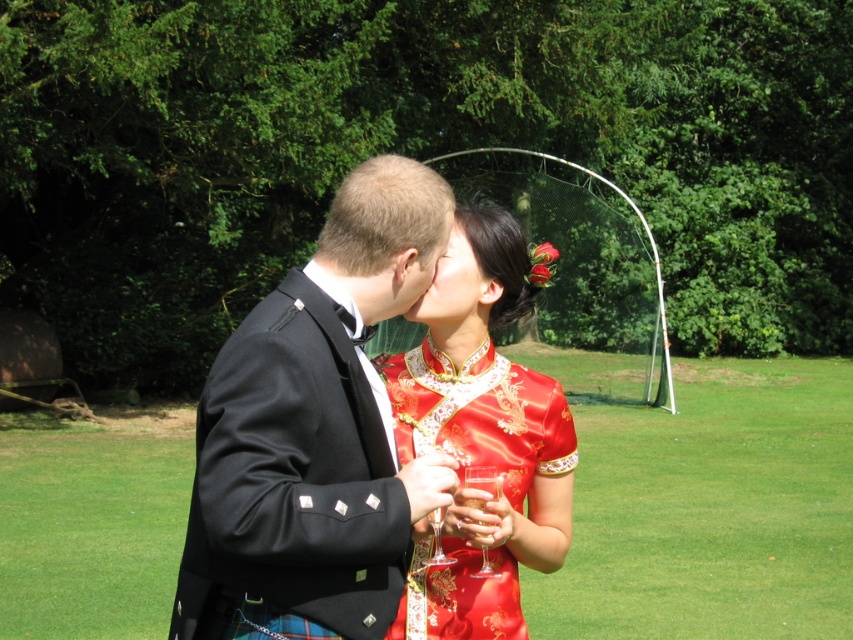
You are a photographer at a cultural exchange event. You need to position two models wearing the black satin suit at center and the silky red dress at center so that both are visible in the frame. Given their sizes, which model should stand closer to the camera to ensure both appear equally sized in the photo?

The black satin suit at center is smaller than the silky red dress at center, so the model in the black satin suit at center should stand closer to the camera to appear the same size as the silky red dress at center in the photo.

You are a photographer at the event and need to position a spotlight on the black satin suit at center. The spotlight can only be placed at the coordinates provided. Is the point at coordinates (314, 433) suitable for illuminating the black satin suit at center?

Yes, the point at coordinates (314, 433) is suitable for illuminating the black satin suit at center as it directly indicates the location of the suit.

You are a photographer at this event and want to ensure both the black satin suit at center and the silky red dress at center are clearly visible in your photo. Based on their positions, which one is positioned higher in the frame?

The black satin suit at center is located above the silky red dress at center, so it is positioned higher in the frame.